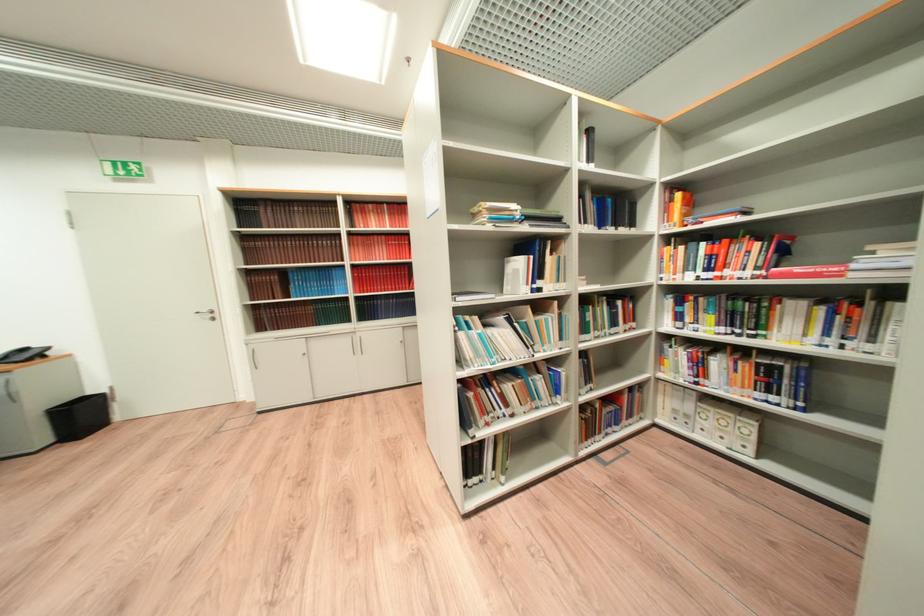
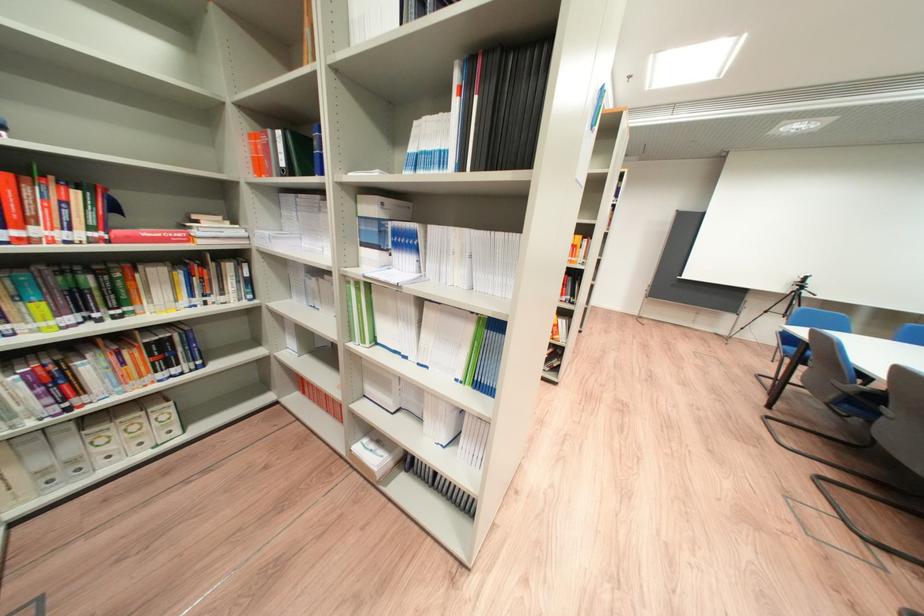
Find the pixel in the second image that matches point 728,257 in the first image.

(9, 201)